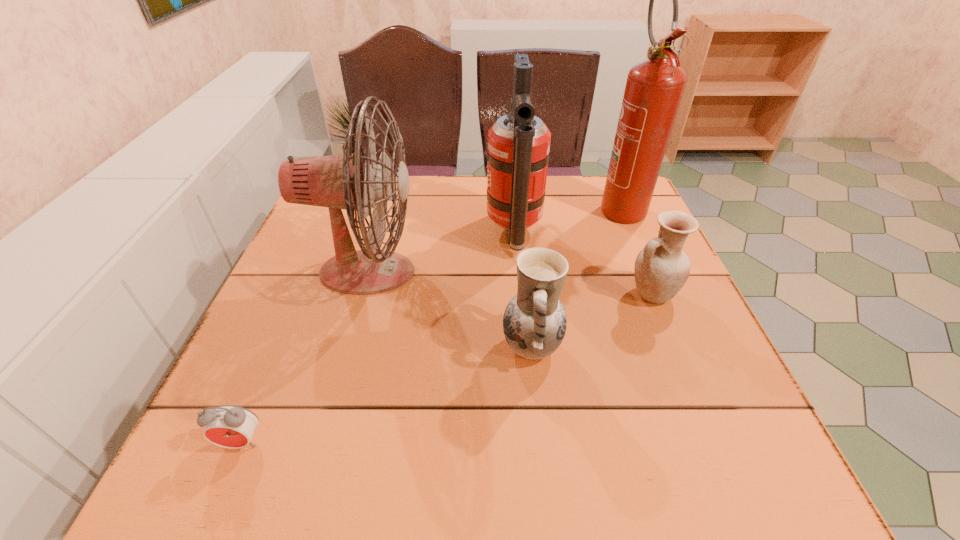
Find the location of a particular element. alarm clock present at the left edge is located at coordinates (228, 426).

Identify the location of fire extinguisher that is at the right edge. (654, 87).

Identify the location of pottery situated at the right edge. pos(661,268).

Where is `object at the near left corner`? This screenshot has height=540, width=960. object at the near left corner is located at coordinates (228, 426).

Identify the location of object present at the far right corner. Image resolution: width=960 pixels, height=540 pixels. (654, 87).

Identify the location of free space at the far edge of the desktop. (438, 178).

I want to click on vacant space at the left edge of the desktop, so click(x=328, y=297).

The width and height of the screenshot is (960, 540). In the image, there is a desktop. Find the location of `free space at the right edge`. free space at the right edge is located at coordinates (645, 342).

In the image, there is a desktop. Where is `vacant space at the near left corner`? The width and height of the screenshot is (960, 540). vacant space at the near left corner is located at coordinates (186, 487).

Where is `unoccupied position between the farther pottery and the alarm clock`? The height and width of the screenshot is (540, 960). unoccupied position between the farther pottery and the alarm clock is located at coordinates (446, 368).